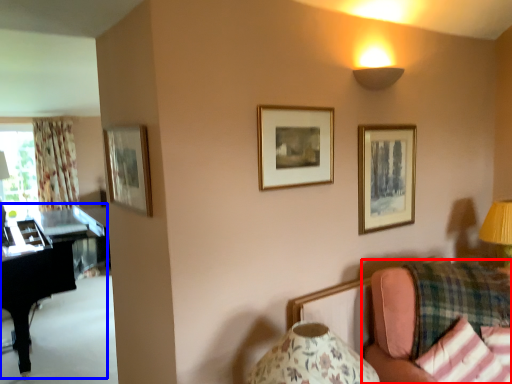
Question: Among these objects, which one is nearest to the camera, studio couch (highlighted by a red box) or piano (highlighted by a blue box)?

Choices:
 (A) studio couch
 (B) piano

Answer: (A)